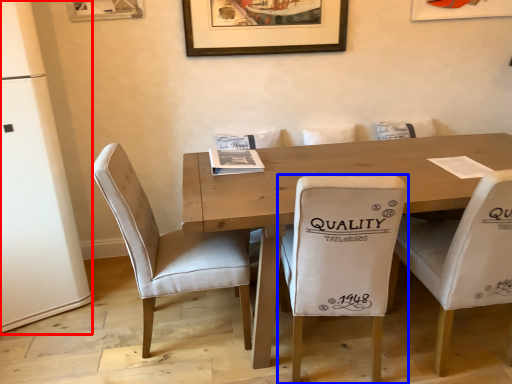
Question: Which of the following is the closest to the observer, fridge (highlighted by a red box) or chair (highlighted by a blue box)?

Choices:
 (A) fridge
 (B) chair

Answer: (B)